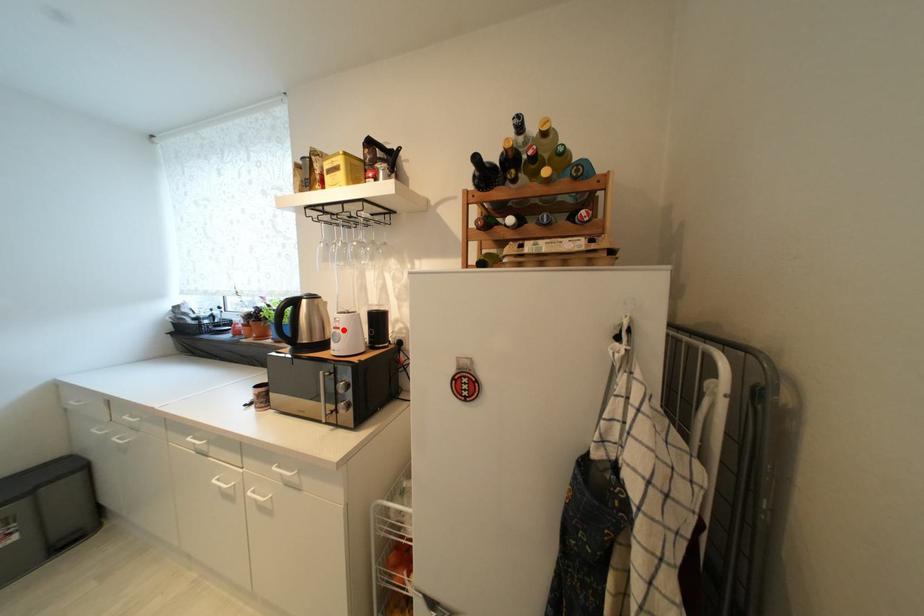
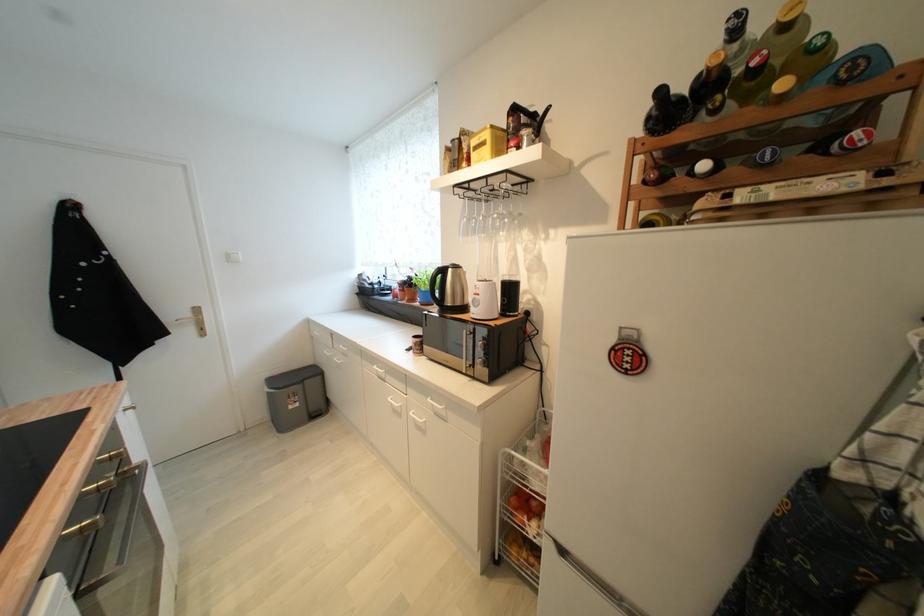
The point at the highlighted location is marked in the first image. Where is the corresponding point in the second image?

(483, 296)